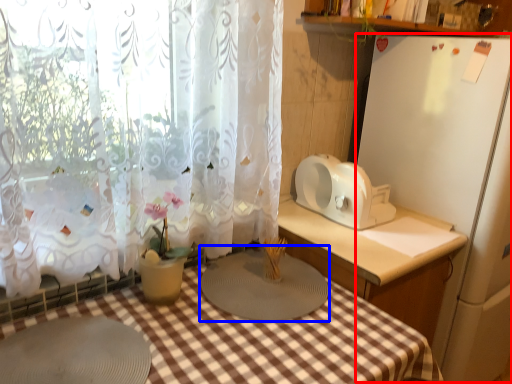
Question: Which object appears farthest to the camera in this image, appliance (highlighted by a red box) or appliance (highlighted by a blue box)?

Choices:
 (A) appliance
 (B) appliance

Answer: (A)